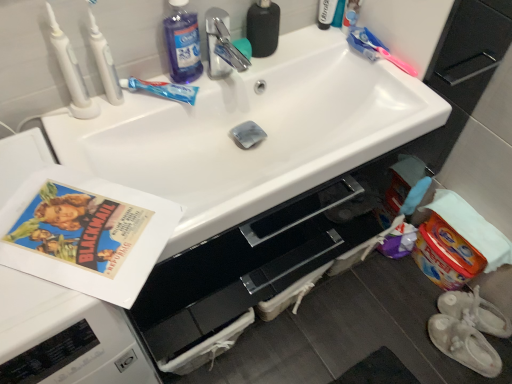
Where is `vacant space to the right of black matte bottle at upper center`? vacant space to the right of black matte bottle at upper center is located at coordinates (314, 48).